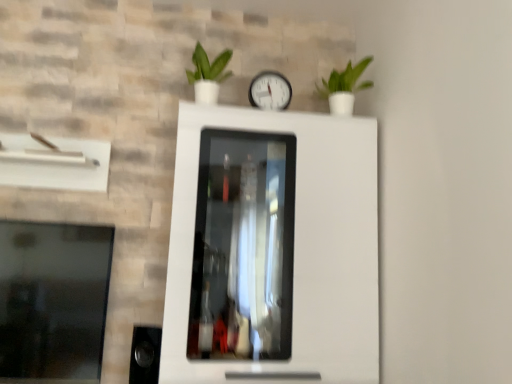
Question: Is transparent glass window at left bigger or smaller than white plastic clock at center?

Choices:
 (A) small
 (B) big

Answer: (B)

Question: From a real-world perspective, relative to white plastic clock at center, is transparent glass window at left vertically above or below?

Choices:
 (A) above
 (B) below

Answer: (B)

Question: Estimate the real-world distances between objects in this image. Which object is closer to the transparent glass window at left?

Choices:
 (A) white plastic clock at center
 (B) green matte plant at upper right, arranged as the first houseplant when viewed from the right
 (C) green matte plant at upper center, the 2th houseplant from the right

Answer: (C)

Question: Which object is the farthest from the white plastic clock at center?

Choices:
 (A) transparent glass window at left
 (B) green matte plant at upper center, the 2th houseplant from the right
 (C) green matte plant at upper right, which appears as the second houseplant when viewed from the left

Answer: (A)